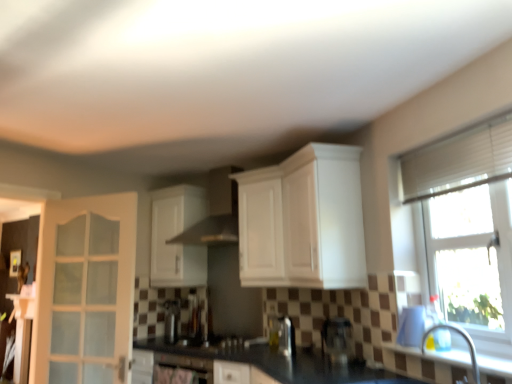
Question: From a real-world perspective, relative to silver metallic faucet at lower right, is transparent glass window at right vertically above or below?

Choices:
 (A) above
 (B) below

Answer: (A)

Question: Considering their positions, is transparent glass window at right located in front of or behind silver metallic faucet at lower right?

Choices:
 (A) front
 (B) behind

Answer: (B)

Question: Which of these objects is positioned farthest from the white glossy window sill at lower right?

Choices:
 (A) transparent glass window at right
 (B) white plastic shutter at upper right
 (C) white glass door at left
 (D) satin black coffee machine at center, the 1th coffee machine in the right-to-left sequence
 (E) white glossy cabinet at upper center, which appears as the 1th cabinetry when viewed from the right

Answer: (C)

Question: Estimate the real-world distances between objects in this image. Which object is closer to the satin silver kettle at center?

Choices:
 (A) black granite countertop at center
 (B) sleek metallic coffee machine at center, placed as the 2th coffee machine when sorted from right to left
 (C) white glossy cabinet at upper center, the second cabinetry in the front-to-back sequence
 (D) satin black coffee machine at center, the 2th coffee machine positioned from the left
 (E) white glass door at left

Answer: (C)